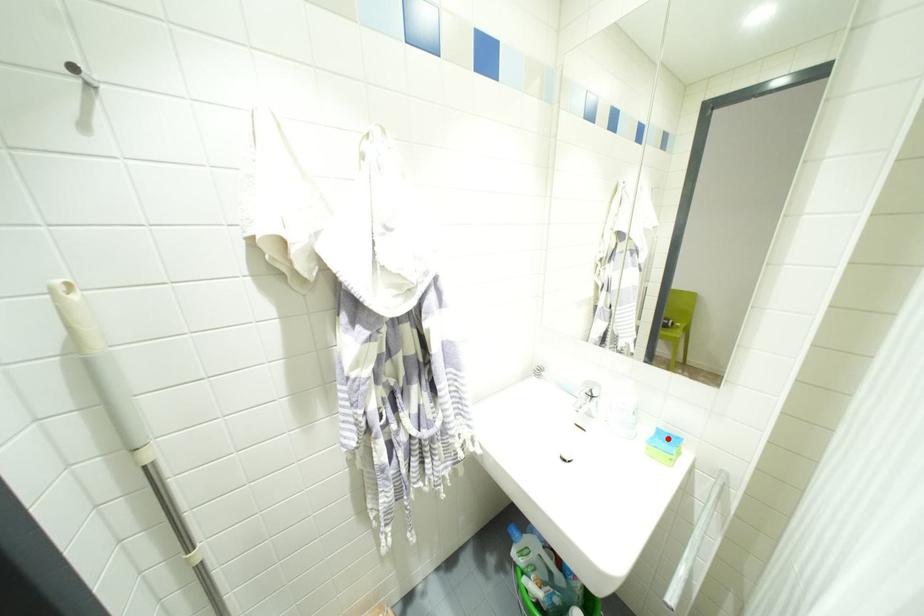
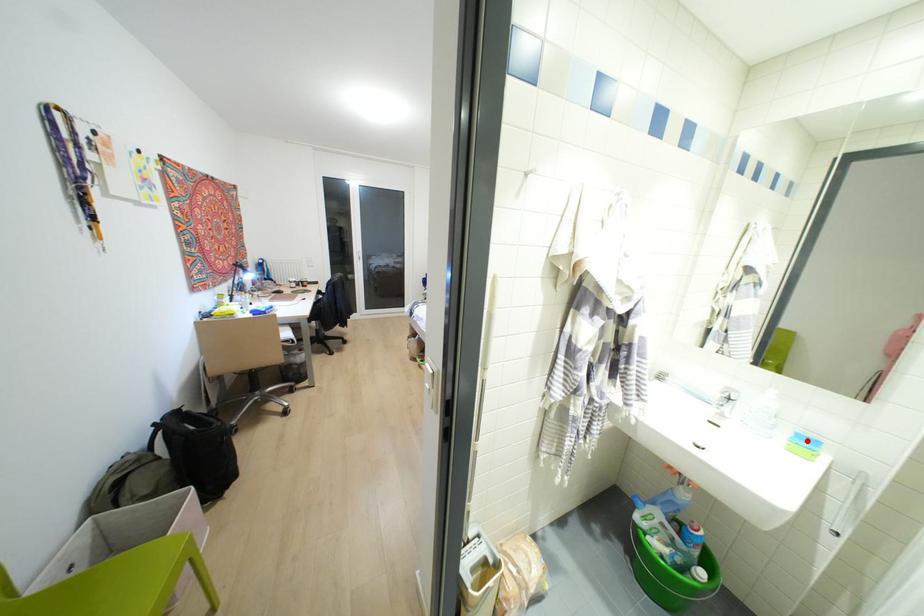
I am providing you with two images of the same scene from different viewpoints. A red point is marked on the first image and another point is marked on the second image. Do the highlighted points in image1 and image2 indicate the same real-world spot?

Yes